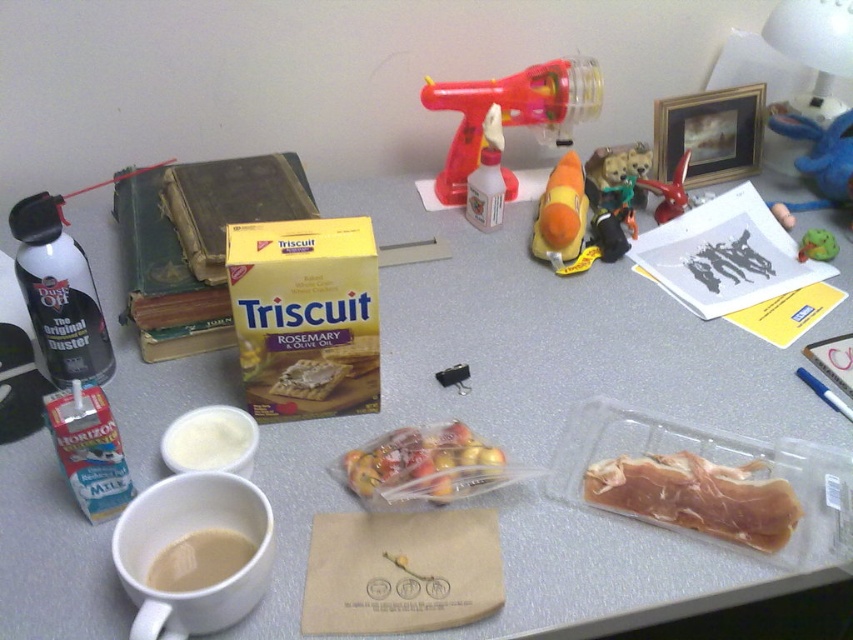
Identify the location of plush toy at center. The height and width of the screenshot is (640, 853). (618, 180).

Is plush toy at center below green rubber toy at center?

Incorrect, plush toy at center is not positioned below green rubber toy at center.

Which is behind, point (641, 200) or point (836, 244)?

The point (641, 200) is more distant.

Where is `plush toy at center`? This screenshot has width=853, height=640. plush toy at center is located at coordinates (618, 180).

Is orange rubber toy at center positioned before blue plush toy at upper right?

Yes, it is in front of blue plush toy at upper right.

The height and width of the screenshot is (640, 853). Find the location of `orange rubber toy at center`. orange rubber toy at center is located at coordinates (572, 221).

Does rubber duck at upper right appear over green rubber toy at center?

Yes, rubber duck at upper right is above green rubber toy at center.

Which is below, rubber duck at upper right or green rubber toy at center?

green rubber toy at center

Image resolution: width=853 pixels, height=640 pixels. What do you see at coordinates (669, 192) in the screenshot?
I see `rubber duck at upper right` at bounding box center [669, 192].

Identify the location of rubber duck at upper right. This screenshot has height=640, width=853. (669, 192).